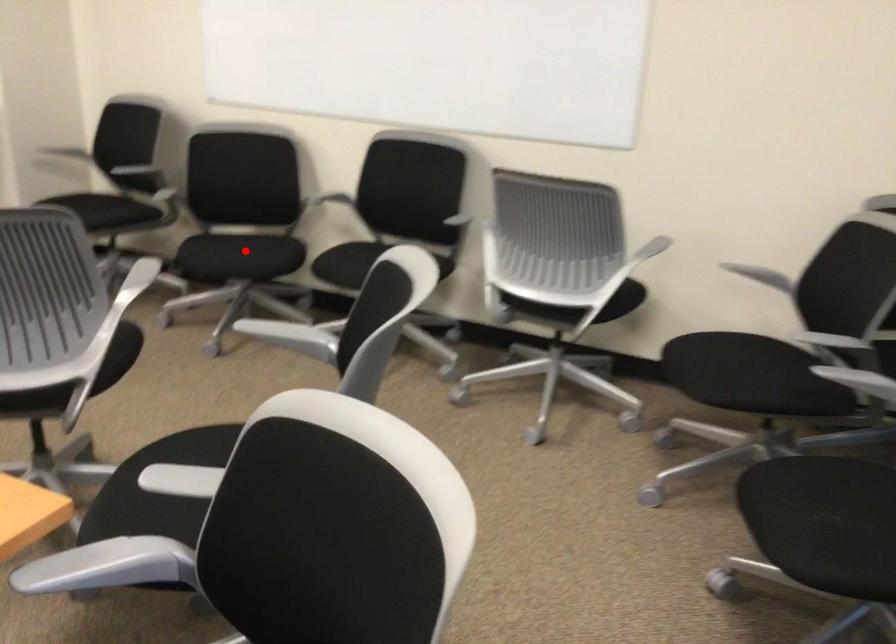
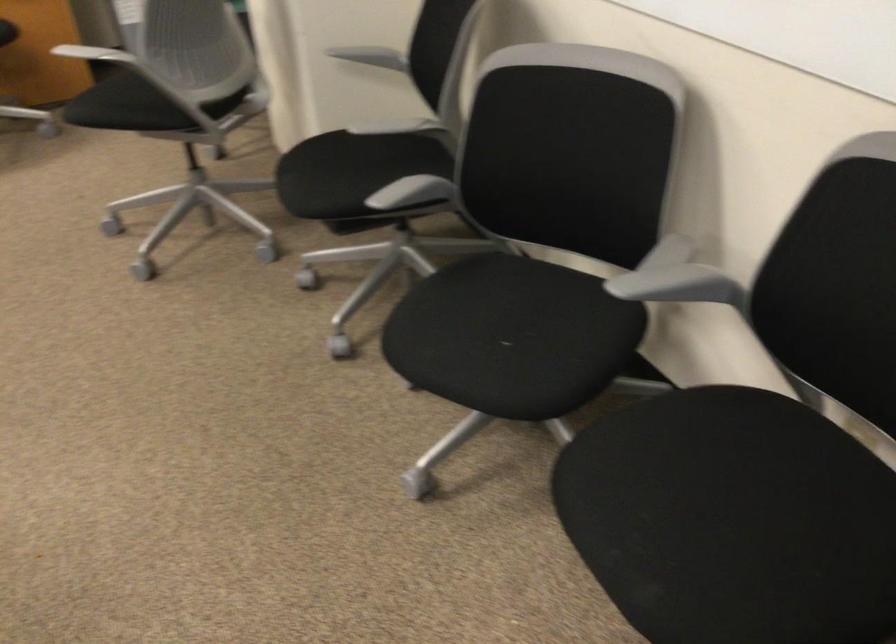
The point at the highlighted location is marked in the first image. Where is the corresponding point in the second image?

(494, 337)